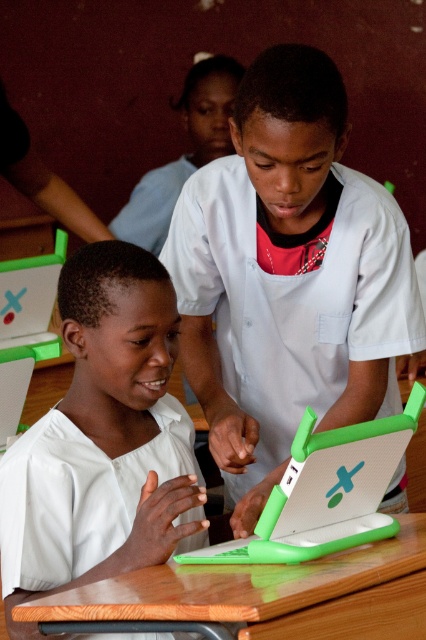
You are a teacher observing the classroom. You notice two children working on a laptop. The first child is wearing a matte white shirt at center, and the second child is wearing a white matte shirt at center. How far apart are these two children from each other?

The distance between the matte white shirt at center and the white matte shirt at center is 11.91 inches.

In the classroom scene, there are two children wearing a matte white shirt at center and a white matte shirt at center. Which child has a wider shirt?

The matte white shirt at center has a greater width than the white matte shirt at center, so the child wearing the matte white shirt at center has the wider shirt.